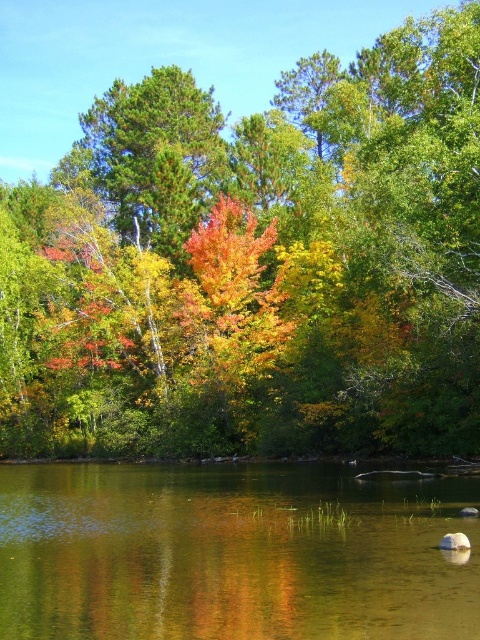
You are standing at the edge of the water in the serene natural scene. There is a point marked at coordinates (255,264) which corresponds to autumn leaves at center. Can you see the autumn leaves at center from your current position?

Yes, the point marked at coordinates (255,264) indicates that the autumn leaves at center are directly in front of you, so you can see them clearly from your position at the water edge.

Looking at the serene natural scene with autumn leaves at center and clear water at center, which object is positioned to the left when viewed from the front?

The autumn leaves at center are to the left of the clear water at center.